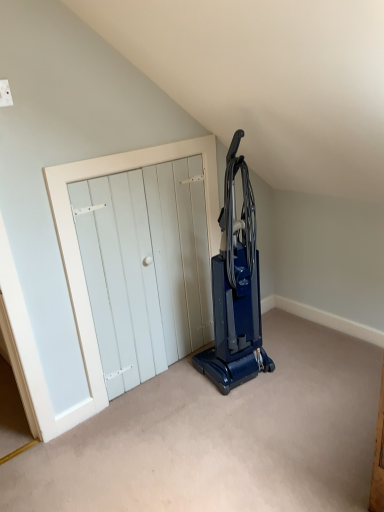
Question: Can we say white wooden door at center lies outside blue plastic vacuum cleaner at center?

Choices:
 (A) no
 (B) yes

Answer: (B)

Question: Considering the relative sizes of white wooden door at center and blue plastic vacuum cleaner at center in the image provided, is white wooden door at center bigger than blue plastic vacuum cleaner at center?

Choices:
 (A) yes
 (B) no

Answer: (B)

Question: Can you confirm if white wooden door at center is smaller than blue plastic vacuum cleaner at center?

Choices:
 (A) yes
 (B) no

Answer: (A)

Question: Is white wooden door at center closer to the viewer compared to blue plastic vacuum cleaner at center?

Choices:
 (A) no
 (B) yes

Answer: (A)

Question: Can you confirm if white wooden door at center is thinner than blue plastic vacuum cleaner at center?

Choices:
 (A) yes
 (B) no

Answer: (A)

Question: Are white wooden door at center and blue plastic vacuum cleaner at center located far from each other?

Choices:
 (A) no
 (B) yes

Answer: (A)

Question: Can you confirm if blue plastic vacuum cleaner at center is wider than white wooden door at center?

Choices:
 (A) no
 (B) yes

Answer: (B)

Question: From the image's perspective, is blue plastic vacuum cleaner at center below white wooden door at center?

Choices:
 (A) yes
 (B) no

Answer: (B)

Question: From a real-world perspective, is blue plastic vacuum cleaner at center on white wooden door at center?

Choices:
 (A) yes
 (B) no

Answer: (A)

Question: Is blue plastic vacuum cleaner at center positioned before white wooden door at center?

Choices:
 (A) yes
 (B) no

Answer: (A)

Question: Is blue plastic vacuum cleaner at center facing towards white wooden door at center?

Choices:
 (A) yes
 (B) no

Answer: (B)

Question: Is white wooden door at center at the back of blue plastic vacuum cleaner at center?

Choices:
 (A) yes
 (B) no

Answer: (A)

Question: Looking at their shapes, would you say blue plastic vacuum cleaner at center is wider or thinner than white wooden door at center?

Choices:
 (A) thin
 (B) wide

Answer: (B)